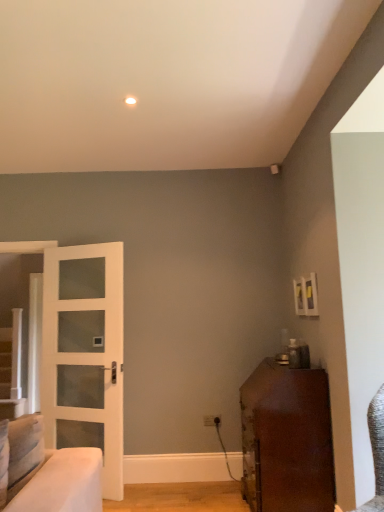
Question: Looking at their shapes, would you say shiny brown cabinet at lower right is wider or thinner than white glass door at left?

Choices:
 (A) wide
 (B) thin

Answer: (A)

Question: Would you say shiny brown cabinet at lower right is inside or outside white glass door at left?

Choices:
 (A) inside
 (B) outside

Answer: (B)

Question: Does point (261, 365) appear closer or farther from the camera than point (117, 251)?

Choices:
 (A) closer
 (B) farther

Answer: (A)

Question: Considering the positions of white glass door at left and shiny brown cabinet at lower right in the image, is white glass door at left wider or thinner than shiny brown cabinet at lower right?

Choices:
 (A) thin
 (B) wide

Answer: (A)

Question: Considering the positions of point (87, 251) and point (291, 508), is point (87, 251) closer or farther from the camera than point (291, 508)?

Choices:
 (A) closer
 (B) farther

Answer: (B)

Question: Considering the positions of white glass door at left and shiny brown cabinet at lower right in the image, is white glass door at left bigger or smaller than shiny brown cabinet at lower right?

Choices:
 (A) small
 (B) big

Answer: (A)

Question: Is white glass door at left inside or outside of shiny brown cabinet at lower right?

Choices:
 (A) outside
 (B) inside

Answer: (A)